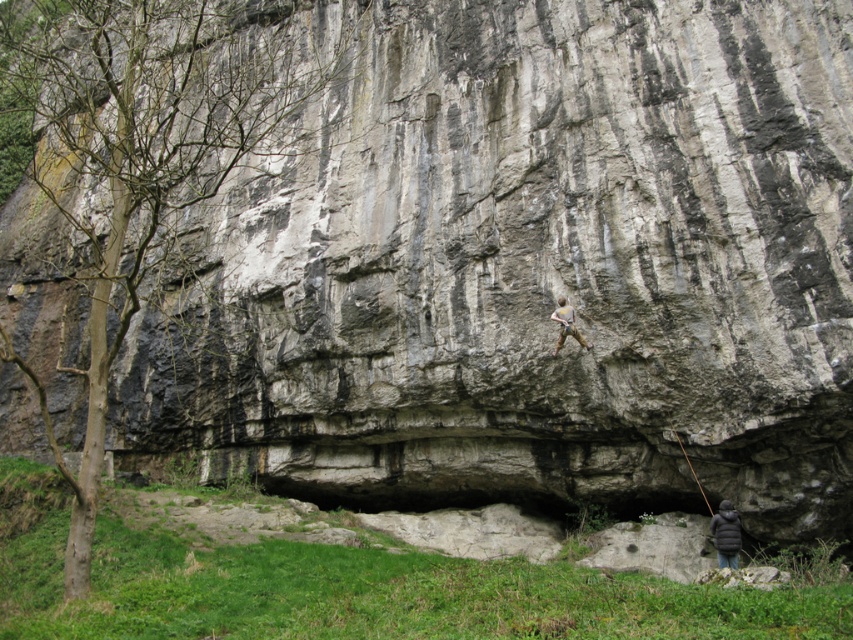
You are standing at the center of the image and want to locate the bare wood tree at left. Based on the coordinates provided, in which direction should you look to find it?

The bare wood tree at left is located at coordinates point (142,161), which means you should look to the left side of the frame to find it.

Looking at this image, you are standing at the base of the large rock formation and want to reach the point marked at coordinates point (74, 248). Given that you can walk 250 feet before needing to rest, will you be able to reach the point without resting?

The distance between you and point (74, 248) is 232.19 feet, which is less than your 250 feet walking capacity. Therefore, you can reach the point without needing to rest.